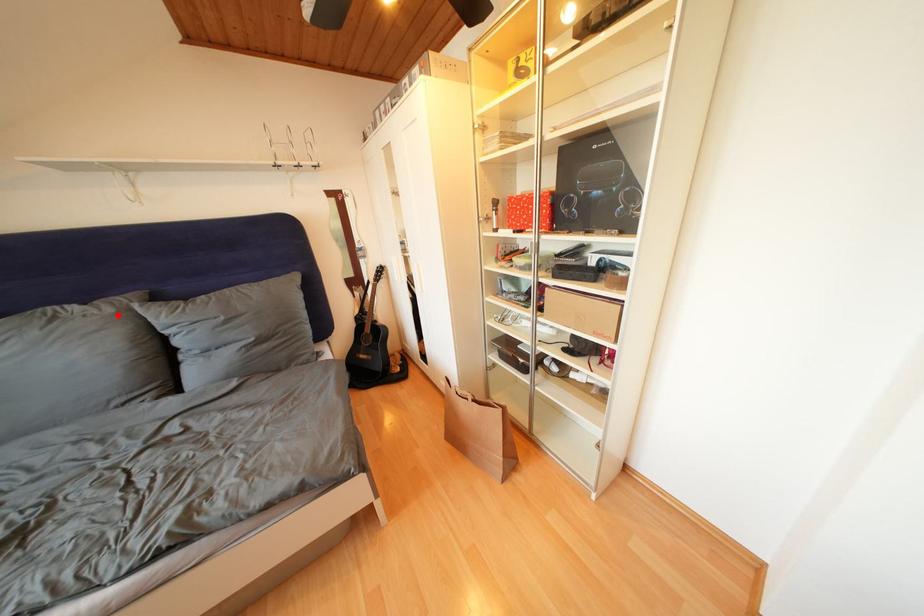
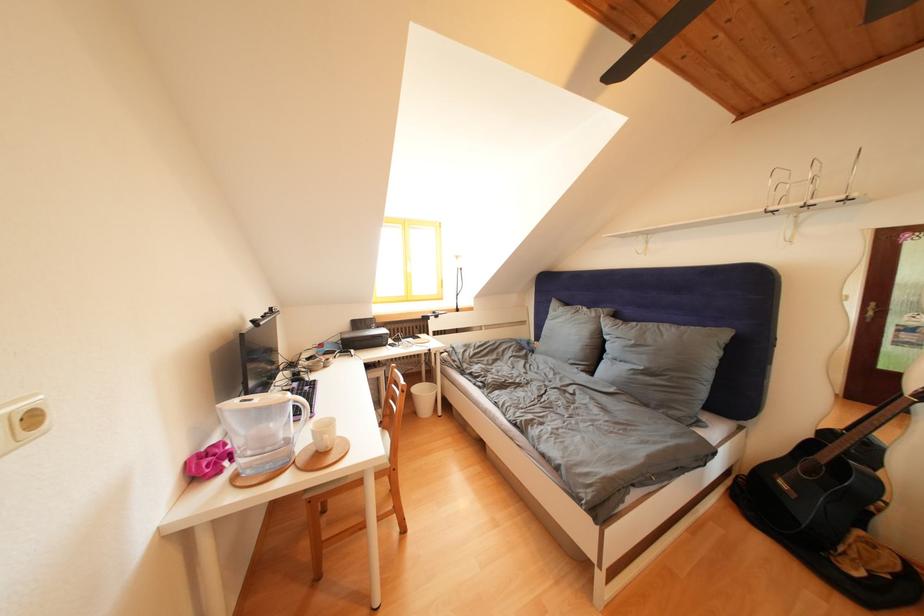
Find the pixel in the second image that matches the highlighted location in the first image.

(602, 320)